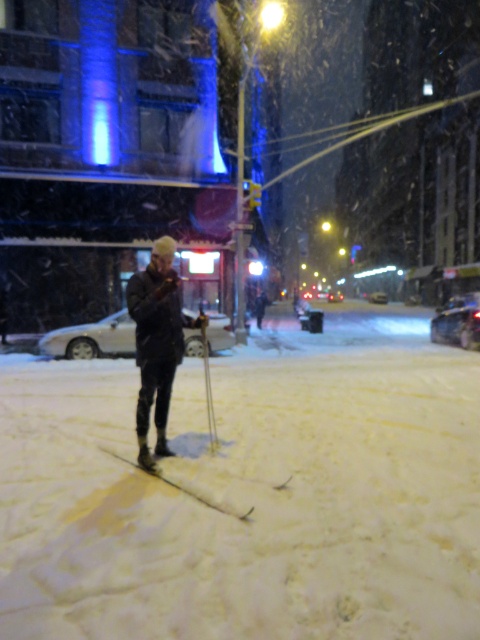
You are standing at point (x=156, y=340) in the snowy urban street scene. What object is located exactly at your current position?

The dark gray fabric jacket at center is located exactly at point (x=156, y=340).

Based on the photo, you are standing on the snowy street and see the white fluffy snow at center and the dark gray fabric jacket at center. Which object takes up more space in the scene?

The white fluffy snow at center takes up more space in the scene because it has a larger size compared to the dark gray fabric jacket at center.